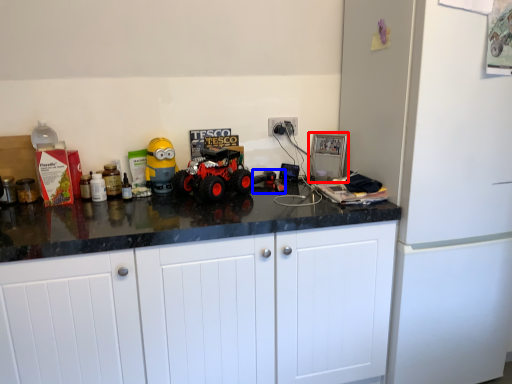
Question: Among these objects, which one is nearest to the camera, appliance (highlighted by a red box) or toy (highlighted by a blue box)?

Choices:
 (A) appliance
 (B) toy

Answer: (B)